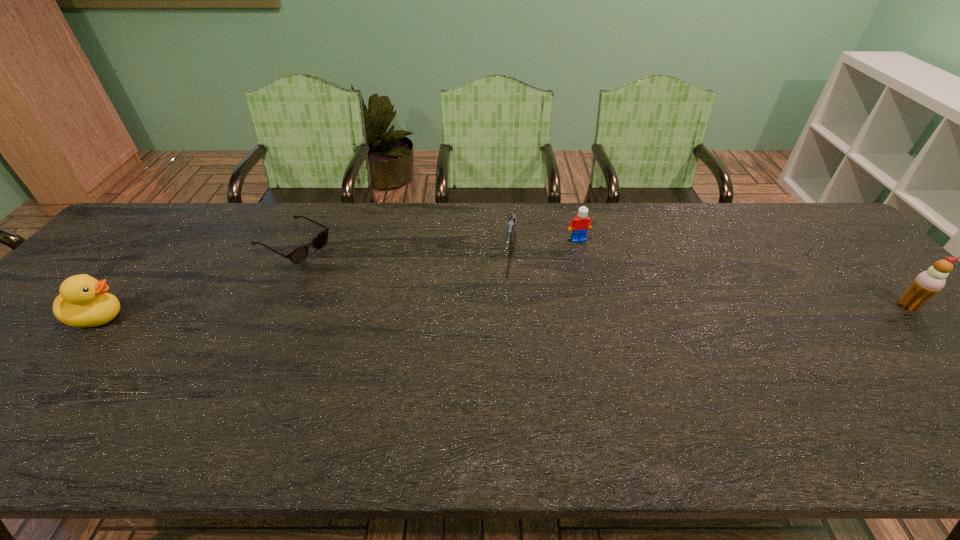
Where is `free spot between the sunglasses and the gun`? Image resolution: width=960 pixels, height=540 pixels. free spot between the sunglasses and the gun is located at coordinates (401, 249).

Locate an element on the screen. The image size is (960, 540). empty location between the fourth object from right to left and the third object from right to left is located at coordinates (401, 249).

This screenshot has width=960, height=540. Find the location of `vacant area between the duck and the second object from right to left`. vacant area between the duck and the second object from right to left is located at coordinates (338, 278).

Where is `vacant area that lies between the third object from left to right and the second object from right to left`? vacant area that lies between the third object from left to right and the second object from right to left is located at coordinates (544, 246).

Locate an element on the screen. The height and width of the screenshot is (540, 960). blank region between the fourth object from right to left and the second object from right to left is located at coordinates (436, 242).

Find the location of `free space between the sunglasses and the fourth object from left to right`. free space between the sunglasses and the fourth object from left to right is located at coordinates (436, 242).

I want to click on empty location between the tallest object and the duck, so click(503, 311).

Image resolution: width=960 pixels, height=540 pixels. In order to click on free space between the third object from left to right and the Lego in this screenshot , I will do `click(544, 246)`.

I want to click on vacant space that is in between the leftmost object and the Lego, so click(x=338, y=278).

You are a GUI agent. You are given a task and a screenshot of the screen. Output one action in this format:
    pyautogui.click(x=<x>, y=<y>)
    Task: Click on the object that is the second closest to the rightmost object
    
    Given the screenshot: What is the action you would take?
    pyautogui.click(x=512, y=220)